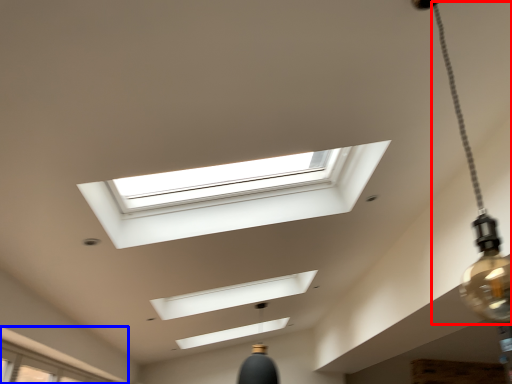
Question: Among these objects, which one is nearest to the camera, lamp (highlighted by a red box) or window (highlighted by a blue box)?

Choices:
 (A) lamp
 (B) window

Answer: (A)